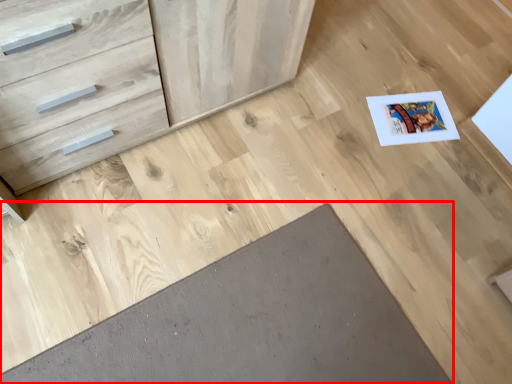
Question: Considering the relative positions of doormat (annotated by the red box) and chest of drawers in the image provided, where is doormat (annotated by the red box) located with respect to the staircase?

Choices:
 (A) right
 (B) left

Answer: (A)